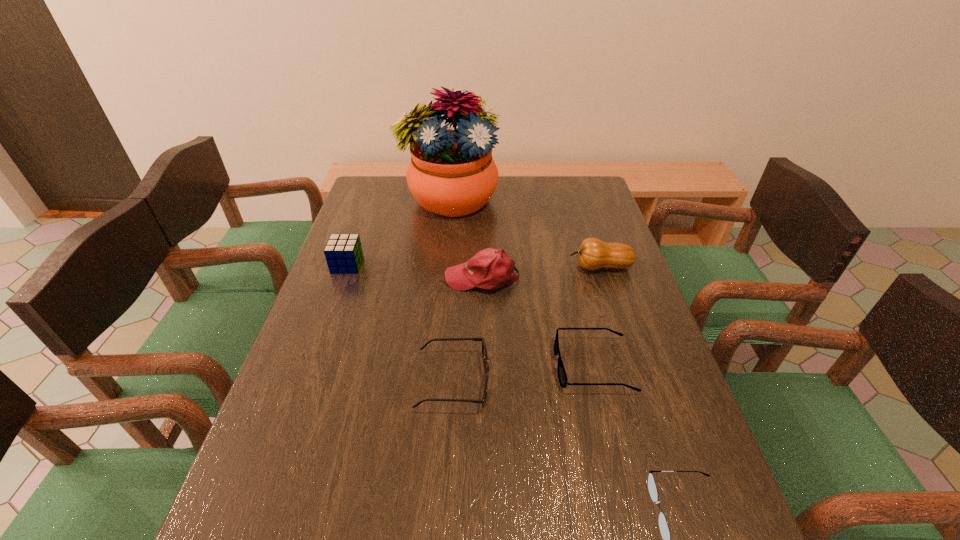
At what (x,y) coordinates should I click in order to perform the action: click on spectacles positioned at the right edge. Please return your answer as a coordinate pair (x, y). Looking at the image, I should click on (562, 376).

You are a GUI agent. You are given a task and a screenshot of the screen. Output one action in this format:
    pyautogui.click(x=<x>, y=<y>)
    Task: Click on the object at the far left corner
    
    Given the screenshot: What is the action you would take?
    pyautogui.click(x=452, y=173)

Find the location of a particular element. The image size is (960, 540). vacant area at the far edge of the desktop is located at coordinates (407, 184).

In the image, there is a desktop. Identify the location of vacant space at the left edge. (284, 382).

Where is `free spot at the right edge of the desktop`? The width and height of the screenshot is (960, 540). free spot at the right edge of the desktop is located at coordinates (702, 468).

I want to click on free region at the far left corner of the desktop, so click(x=364, y=197).

You are a GUI agent. You are given a task and a screenshot of the screen. Output one action in this format:
    pyautogui.click(x=<x>, y=<y>)
    Task: Click on the vacant region at the far right corner of the desktop
    The width and height of the screenshot is (960, 540).
    Given the screenshot: What is the action you would take?
    pyautogui.click(x=595, y=186)

Find the location of a particular element. This screenshot has width=960, height=540. vacant region between the baseball cap and the tallest object is located at coordinates (466, 239).

Image resolution: width=960 pixels, height=540 pixels. Identify the location of free space between the tallest object and the leftmost object. (398, 232).

Locate an element on the screen. The height and width of the screenshot is (540, 960). empty space between the gourd and the leftmost spectacles is located at coordinates (527, 324).